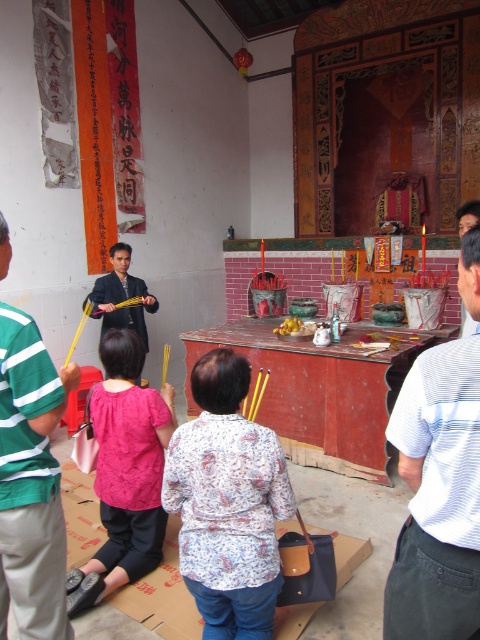
Question: Is floral-patterned blouse at center wider than green striped shirt at left?

Choices:
 (A) no
 (B) yes

Answer: (B)

Question: Does floral-patterned blouse at center lie behind matte pink blouse at lower left?

Choices:
 (A) no
 (B) yes

Answer: (A)

Question: Which point is farther to the camera?

Choices:
 (A) matte pink blouse at lower left
 (B) white striped shirt at right
 (C) floral-patterned blouse at center
 (D) green striped shirt at left

Answer: (A)

Question: Is white striped shirt at right thinner than matte pink blouse at lower left?

Choices:
 (A) no
 (B) yes

Answer: (B)

Question: Estimate the real-world distances between objects in this image. Which object is farther from the matte pink blouse at lower left?

Choices:
 (A) floral-patterned blouse at center
 (B) green striped shirt at left

Answer: (B)

Question: Which of the following is the farthest from the observer?

Choices:
 (A) white striped shirt at right
 (B) matte pink blouse at lower left

Answer: (B)